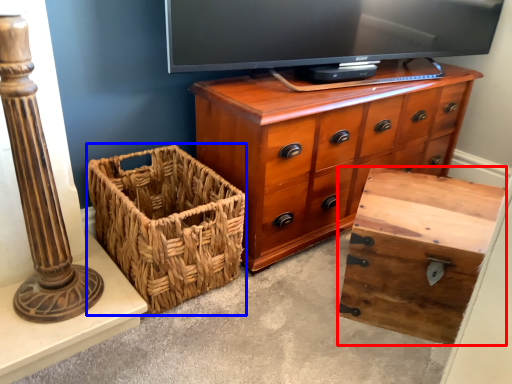
Question: Which object is further to the camera taking this photo, storage box (highlighted by a red box) or basket (highlighted by a blue box)?

Choices:
 (A) storage box
 (B) basket

Answer: (B)